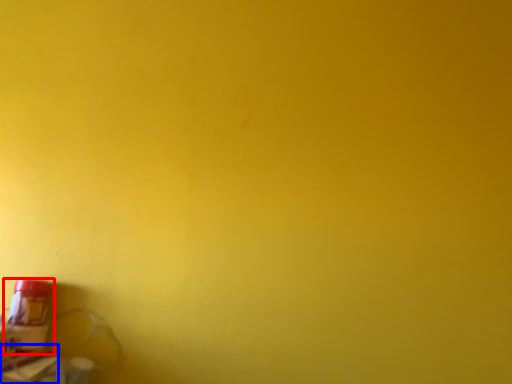
Question: Which point is closer to the camera, bottle (highlighted by a red box) or window sill (highlighted by a blue box)?

Choices:
 (A) bottle
 (B) window sill

Answer: (B)